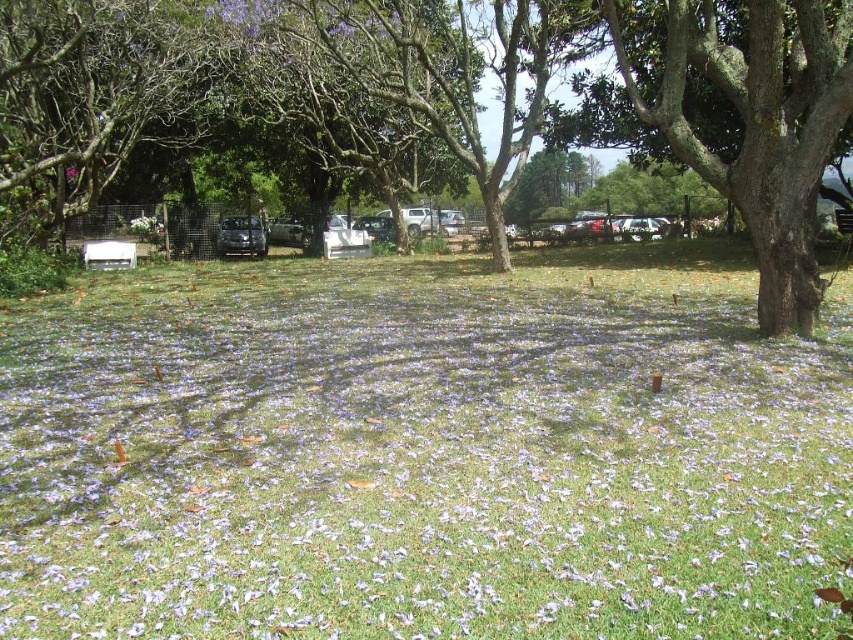
Question: Is satin black car at center to the left of white matte bench at lower left from the viewer's perspective?

Choices:
 (A) no
 (B) yes

Answer: (A)

Question: Is green leafy tree at center in front of satin black car at center?

Choices:
 (A) no
 (B) yes

Answer: (B)

Question: Which is farther from the white matte bench at lower left?

Choices:
 (A) purple grass at center
 (B) green leafy tree at center
 (C) satin black car at center

Answer: (A)

Question: Is purple grass at center smaller than green leafy tree at center?

Choices:
 (A) no
 (B) yes

Answer: (B)

Question: Which of the following is the farthest from the observer?

Choices:
 (A) green leafy tree at center
 (B) purple grass at center
 (C) satin black car at center

Answer: (C)

Question: Which point is farther to the camera?

Choices:
 (A) (3, 120)
 (B) (245, 250)
 (C) (125, 262)
 (D) (393, 392)

Answer: (B)